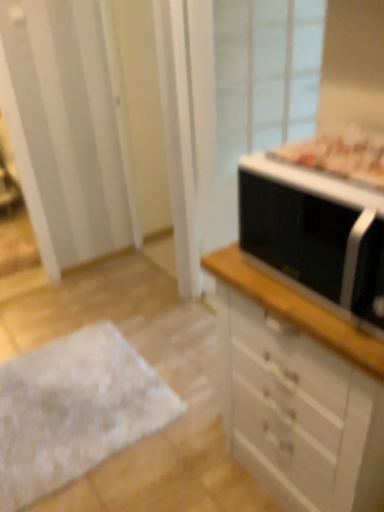
Question: Is white fluffy rug at lower left wider than black matte microwave at right?

Choices:
 (A) no
 (B) yes

Answer: (B)

Question: From the image's perspective, is white fluffy rug at lower left on top of black matte microwave at right?

Choices:
 (A) yes
 (B) no

Answer: (B)

Question: Considering the relative sizes of white fluffy rug at lower left and black matte microwave at right in the image provided, is white fluffy rug at lower left smaller than black matte microwave at right?

Choices:
 (A) no
 (B) yes

Answer: (B)

Question: Is white fluffy rug at lower left to the right of black matte microwave at right from the viewer's perspective?

Choices:
 (A) no
 (B) yes

Answer: (A)

Question: From a real-world perspective, is white fluffy rug at lower left located beneath black matte microwave at right?

Choices:
 (A) yes
 (B) no

Answer: (A)

Question: Does white fluffy rug at lower left have a lesser height compared to black matte microwave at right?

Choices:
 (A) yes
 (B) no

Answer: (A)

Question: From a real-world perspective, is white glossy chest of drawers at right below transparent glass screen door at upper right?

Choices:
 (A) yes
 (B) no

Answer: (A)

Question: Is transparent glass screen door at upper right inside white glossy chest of drawers at right?

Choices:
 (A) yes
 (B) no

Answer: (B)

Question: Considering the relative sizes of white glossy chest of drawers at right and transparent glass screen door at upper right in the image provided, is white glossy chest of drawers at right shorter than transparent glass screen door at upper right?

Choices:
 (A) no
 (B) yes

Answer: (B)

Question: From the image's perspective, is white glossy chest of drawers at right under transparent glass screen door at upper right?

Choices:
 (A) yes
 (B) no

Answer: (A)

Question: From a real-world perspective, is white glossy chest of drawers at right positioned over transparent glass screen door at upper right based on gravity?

Choices:
 (A) no
 (B) yes

Answer: (A)

Question: Can you confirm if white glossy chest of drawers at right is wider than transparent glass screen door at upper right?

Choices:
 (A) no
 (B) yes

Answer: (B)

Question: Are white fluffy rug at lower left and transparent glass screen door at upper right far apart?

Choices:
 (A) no
 (B) yes

Answer: (B)